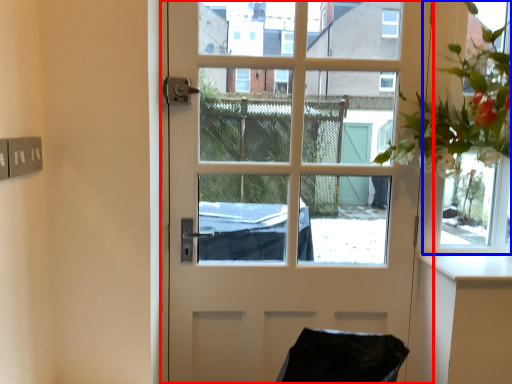
Question: Among these objects, which one is farthest to the camera, door (highlighted by a red box) or window frame (highlighted by a blue box)?

Choices:
 (A) door
 (B) window frame

Answer: (B)